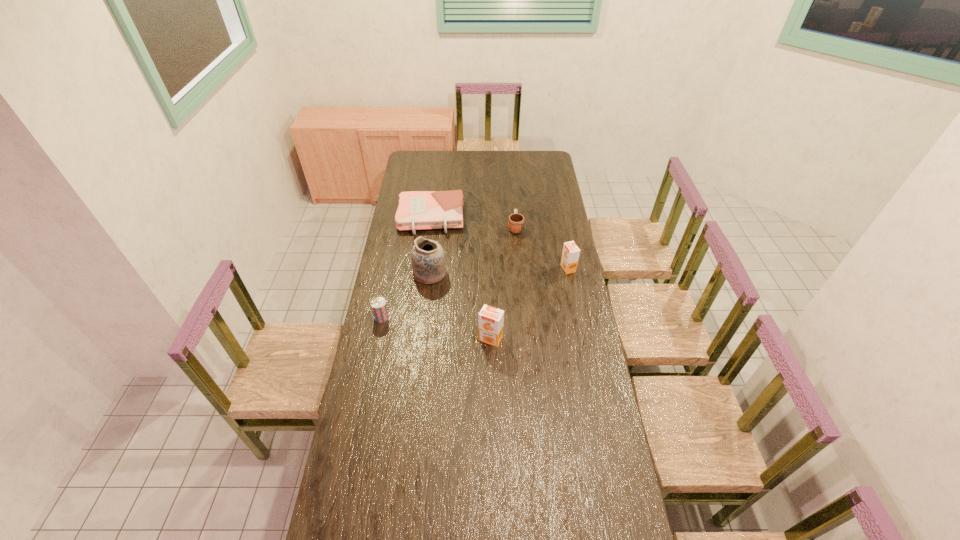
Locate an element on the screen. Image resolution: width=960 pixels, height=540 pixels. empty space between the nearest object and the second nearest object is located at coordinates (436, 328).

Where is `free space between the phonebook and the taller orange juice`? free space between the phonebook and the taller orange juice is located at coordinates (461, 279).

Point out which object is positioned as the second nearest to the rightmost object. Please provide its 2D coordinates. Your answer should be formatted as a tuple, i.e. [(x, y)], where the tuple contains the x and y coordinates of a point satisfying the conditions above.

[(491, 319)]

Locate which object ranks in proximity to the second nearest object. Please provide its 2D coordinates. Your answer should be formatted as a tuple, i.e. [(x, y)], where the tuple contains the x and y coordinates of a point satisfying the conditions above.

[(428, 260)]

Locate an element on the screen. The image size is (960, 540). free location that satisfies the following two spatial constraints: 1. on the front side of the left orange juice; 2. on the right side of the fifth farthest object is located at coordinates pyautogui.click(x=377, y=339).

Where is `free space that satisfies the following two spatial constraints: 1. on the front side of the phonebook; 2. on the right side of the nearest object`? The width and height of the screenshot is (960, 540). free space that satisfies the following two spatial constraints: 1. on the front side of the phonebook; 2. on the right side of the nearest object is located at coordinates (416, 339).